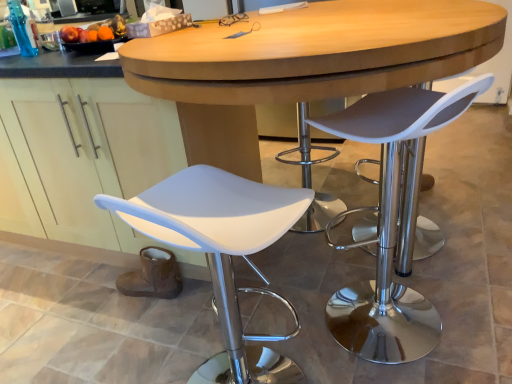
Question: Can you confirm if white matte chair at lower left, which is the 2th chair in right-to-left order, is shorter than matte gray seat at right, which is counted as the first chair, starting from the right?

Choices:
 (A) no
 (B) yes

Answer: (B)

Question: Does white matte chair at lower left, which is counted as the first chair, starting from the left, have a greater height compared to matte gray seat at right, placed as the second chair when sorted from left to right?

Choices:
 (A) yes
 (B) no

Answer: (B)

Question: Is white matte chair at lower left, which is the 2th chair in right-to-left order, turned away from matte gray seat at right, which is counted as the first chair, starting from the right?

Choices:
 (A) yes
 (B) no

Answer: (B)

Question: Are white matte chair at lower left, which is counted as the first chair, starting from the left, and matte gray seat at right, placed as the second chair when sorted from left to right, making contact?

Choices:
 (A) no
 (B) yes

Answer: (A)

Question: Is the depth of white matte chair at lower left, which is counted as the first chair, starting from the left, greater than that of matte gray seat at right, which is counted as the first chair, starting from the right?

Choices:
 (A) no
 (B) yes

Answer: (A)

Question: From the image's perspective, is white matte chair at lower left, which is counted as the first chair, starting from the left, above matte gray seat at right, placed as the second chair when sorted from left to right?

Choices:
 (A) no
 (B) yes

Answer: (A)

Question: Is matte gray seat at right, placed as the second chair when sorted from left to right, not inside white matte chair at lower left, which is the 2th chair in right-to-left order?

Choices:
 (A) yes
 (B) no

Answer: (A)

Question: Considering the relative sizes of matte gray seat at right, placed as the second chair when sorted from left to right, and white matte chair at lower left, which is counted as the first chair, starting from the left, in the image provided, is matte gray seat at right, placed as the second chair when sorted from left to right, wider than white matte chair at lower left, which is counted as the first chair, starting from the left,?

Choices:
 (A) no
 (B) yes

Answer: (A)

Question: Does matte gray seat at right, placed as the second chair when sorted from left to right, have a greater height compared to white matte chair at lower left, which is the 2th chair in right-to-left order?

Choices:
 (A) yes
 (B) no

Answer: (A)

Question: Is matte gray seat at right, which is counted as the first chair, starting from the right, further to camera compared to white matte chair at lower left, which is the 2th chair in right-to-left order?

Choices:
 (A) no
 (B) yes

Answer: (B)

Question: Does matte gray seat at right, placed as the second chair when sorted from left to right, appear on the right side of white matte chair at lower left, which is the 2th chair in right-to-left order?

Choices:
 (A) yes
 (B) no

Answer: (A)

Question: Is matte gray seat at right, placed as the second chair when sorted from left to right, turned away from white matte chair at lower left, which is counted as the first chair, starting from the left?

Choices:
 (A) yes
 (B) no

Answer: (B)

Question: From a real-world perspective, is matte gray seat at right, which is counted as the first chair, starting from the right, above or below white matte chair at lower left, which is counted as the first chair, starting from the left?

Choices:
 (A) above
 (B) below

Answer: (A)